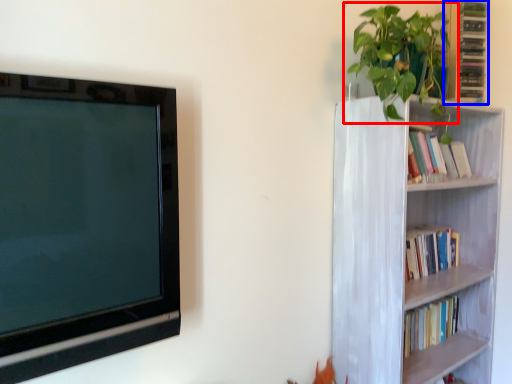
Question: Which object appears closest to the camera in this image, houseplant (highlighted by a red box) or cabinet (highlighted by a blue box)?

Choices:
 (A) houseplant
 (B) cabinet

Answer: (A)